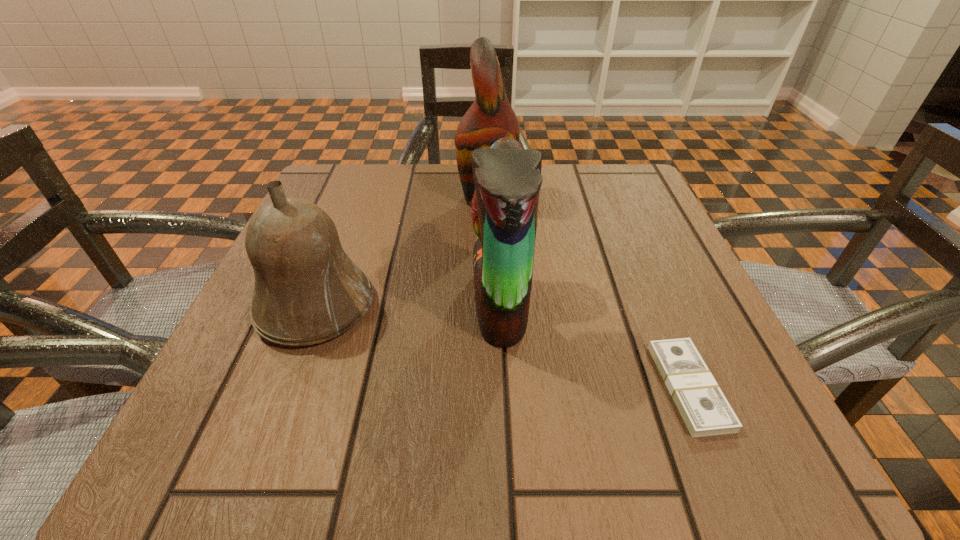
What are the coordinates of `vacant space that satisfies the following two spatial constraints: 1. at the face of the shortest object; 2. on the left side of the nearer parrot` in the screenshot? It's located at (504, 387).

Identify the location of free space that satisfies the following two spatial constraints: 1. at the face of the shorter parrot; 2. on the back side of the dollar. The image size is (960, 540). (504, 387).